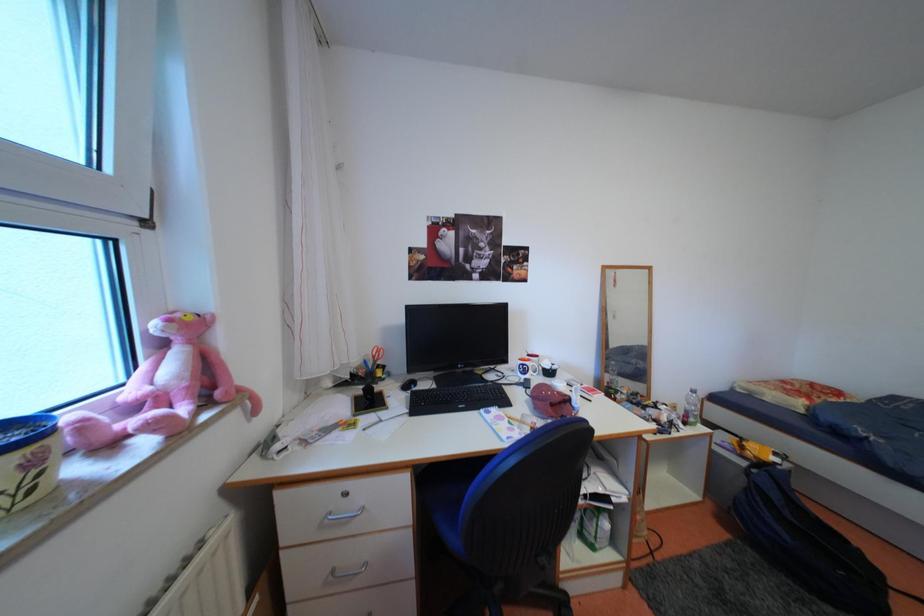
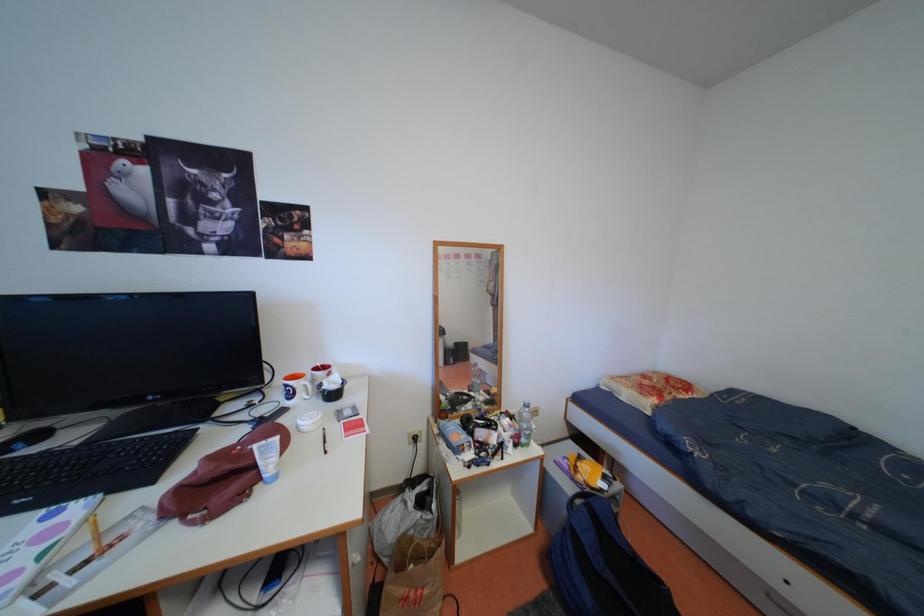
Question: Based on the continuous images, in which direction is the camera rotating? Reply with the corresponding letter.

Choices:
 (A) Left
 (B) Right
 (C) Up
 (D) Down

Answer: (B)